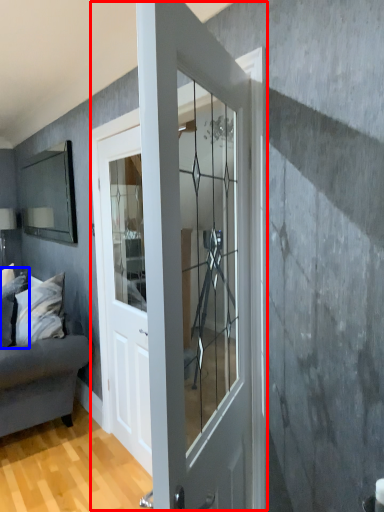
Question: Among these objects, which one is farthest to the camera, door (highlighted by a red box) or pillow (highlighted by a blue box)?

Choices:
 (A) door
 (B) pillow

Answer: (B)